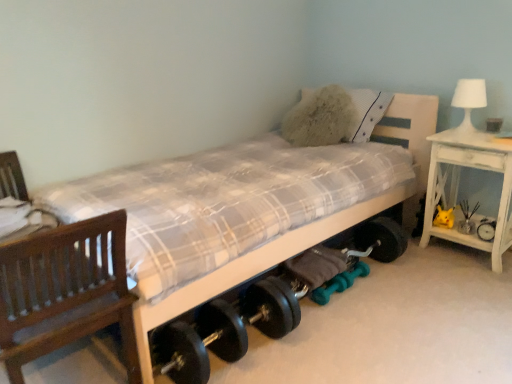
Where is `fuzzy white pillow at upper center`? The image size is (512, 384). fuzzy white pillow at upper center is located at coordinates (368, 111).

The height and width of the screenshot is (384, 512). What do you see at coordinates (332, 288) in the screenshot?
I see `teal rubber dumbbell at lower center, placed as the 2th dumbbell when sorted from right to left` at bounding box center [332, 288].

In order to click on white distressed wood nightstand at right in this screenshot , I will do `click(458, 186)`.

Where is `white wood bed at center`? white wood bed at center is located at coordinates (310, 224).

Is teal rubber dumbbell at lower center, placed as the 2th dumbbell when sorted from right to left, spatially inside white distressed wood nightstand at right, or outside of it?

The correct answer is: outside.

Is teal rubber dumbbell at lower center, marked as the first dumbbell in a left-to-right arrangement, smaller than white distressed wood nightstand at right?

Indeed, teal rubber dumbbell at lower center, marked as the first dumbbell in a left-to-right arrangement, has a smaller size compared to white distressed wood nightstand at right.

From a real-world perspective, is teal rubber dumbbell at lower center, placed as the 2th dumbbell when sorted from right to left, beneath white distressed wood nightstand at right?

Yes.

Does teal rubber dumbbell at lower center, marked as the first dumbbell in a left-to-right arrangement, have a lesser width compared to white distressed wood nightstand at right?

Indeed, teal rubber dumbbell at lower center, marked as the first dumbbell in a left-to-right arrangement, has a lesser width compared to white distressed wood nightstand at right.

Is teal rubber dumbbell at lower center, which appears as the 2th dumbbell when viewed from the left, wider than white distressed wood nightstand at right?

In fact, teal rubber dumbbell at lower center, which appears as the 2th dumbbell when viewed from the left, might be narrower than white distressed wood nightstand at right.

From the picture: Which is farther, (x=355, y=278) or (x=445, y=175)?

Point (x=445, y=175)

Are teal rubber dumbbell at lower center, which appears as the 2th dumbbell when viewed from the left, and white distressed wood nightstand at right making contact?

There is a gap between teal rubber dumbbell at lower center, which appears as the 2th dumbbell when viewed from the left, and white distressed wood nightstand at right.

Is point (344, 290) closer or farther from the camera than point (474, 227)?

Point (344, 290) appears to be closer to the viewer than point (474, 227).

Does teal rubber dumbbell at lower center, placed as the 2th dumbbell when sorted from right to left, have a lesser height compared to yellow plush toy at right?

Yes.

Locate an element on the screen. toy that is above the teal rubber dumbbell at lower center, marked as the first dumbbell in a left-to-right arrangement (from a real-world perspective) is located at coordinates (467, 218).

Which of these two, teal rubber dumbbell at lower center, placed as the 2th dumbbell when sorted from right to left, or yellow plush toy at right, is thinner?

teal rubber dumbbell at lower center, placed as the 2th dumbbell when sorted from right to left, is thinner.

Is white glossy table lamp at upper right located within white distressed wood nightstand at right?

No, white glossy table lamp at upper right is not a part of white distressed wood nightstand at right.

Based on the photo, between white distressed wood nightstand at right and white glossy table lamp at upper right, which one has smaller size?

white glossy table lamp at upper right is smaller.

Which is more distant, (460, 136) or (475, 99)?

Point (475, 99)

Between white distressed wood nightstand at right and white glossy table lamp at upper right, which one appears on the right side from the viewer's perspective?

From the viewer's perspective, white distressed wood nightstand at right appears more on the right side.

What's the angular difference between white distressed wood nightstand at right and yellow plush toy at right's facing directions?

There is a 2.75-degree angle between the facing directions of white distressed wood nightstand at right and yellow plush toy at right.

Is white distressed wood nightstand at right closer to camera compared to yellow plush toy at right?

That is True.

Can you confirm if white distressed wood nightstand at right is wider than yellow plush toy at right?

Yes.

Is teal rubber dumbbell at lower center, the first dumbbell from the right, positioned behind brown wooden chair at left?

That is True.

From a real-world perspective, is teal rubber dumbbell at lower center, which appears as the 2th dumbbell when viewed from the left, positioned over brown wooden chair at left based on gravity?

No.

Is teal rubber dumbbell at lower center, the first dumbbell from the right, far away from brown wooden chair at left?

Yes.

Considering the relative sizes of teal rubber dumbbell at lower center, which appears as the 2th dumbbell when viewed from the left, and brown wooden chair at left in the image provided, is teal rubber dumbbell at lower center, which appears as the 2th dumbbell when viewed from the left, bigger than brown wooden chair at left?

Incorrect, teal rubber dumbbell at lower center, which appears as the 2th dumbbell when viewed from the left, is not larger than brown wooden chair at left.

Find the location of a particular element. This screenshot has height=384, width=512. table lamp on the right of white wood bed at center is located at coordinates (469, 100).

From a real-world perspective, between white glossy table lamp at upper right and white wood bed at center, who is vertically higher?

white glossy table lamp at upper right, from a real-world perspective.

Who is shorter, white glossy table lamp at upper right or white wood bed at center?

white glossy table lamp at upper right is shorter.

Is white glossy table lamp at upper right next to white wood bed at center and touching it?

There is a gap between white glossy table lamp at upper right and white wood bed at center.

Identify the location of nightstand to the right of teal rubber dumbbell at lower center, marked as the first dumbbell in a left-to-right arrangement. This screenshot has width=512, height=384. (458, 186).

The image size is (512, 384). In order to click on nightstand lying above the teal rubber dumbbell at lower center, the first dumbbell from the right (from the image's perspective) in this screenshot , I will do tap(458, 186).

Considering their positions, is yellow plush toy at right positioned closer to white distressed wood nightstand at right than brown wooden chair at left?

Based on the image, yellow plush toy at right appears to be nearer to white distressed wood nightstand at right.

Looking at the image, which one is located further to white wood bed at center, teal rubber dumbbell at lower center, the first dumbbell from the right, or brown wooden chair at left?

Among the two, teal rubber dumbbell at lower center, the first dumbbell from the right, is located further to white wood bed at center.

Estimate the real-world distances between objects in this image. Which object is further from teal rubber dumbbell at lower center, placed as the 2th dumbbell when sorted from right to left, fuzzy white pillow at upper center or white wood bed at center?

Based on the image, fuzzy white pillow at upper center appears to be further to teal rubber dumbbell at lower center, placed as the 2th dumbbell when sorted from right to left.

From the image, which object appears to be nearer to teal rubber dumbbell at lower center, marked as the first dumbbell in a left-to-right arrangement, white distressed wood nightstand at right or brown wooden chair at left?

Among the two, white distressed wood nightstand at right is located nearer to teal rubber dumbbell at lower center, marked as the first dumbbell in a left-to-right arrangement.

From the image, which object appears to be farther from teal rubber dumbbell at lower center, marked as the first dumbbell in a left-to-right arrangement, teal rubber dumbbell at lower center, the first dumbbell from the right, or fuzzy white pillow at upper center?

fuzzy white pillow at upper center.

From the image, which object appears to be nearer to teal rubber dumbbell at lower center, which appears as the 2th dumbbell when viewed from the left, yellow plush toy at right or white wood bed at center?

The object closer to teal rubber dumbbell at lower center, which appears as the 2th dumbbell when viewed from the left, is white wood bed at center.

Consider the image. Based on their spatial positions, is brown wooden chair at left or teal rubber dumbbell at lower center, marked as the first dumbbell in a left-to-right arrangement, closer to white wood bed at center?

brown wooden chair at left is positioned closer to the anchor white wood bed at center.

Estimate the real-world distances between objects in this image. Which object is further from white glossy table lamp at upper right, teal rubber dumbbell at lower center, marked as the first dumbbell in a left-to-right arrangement, or white distressed wood nightstand at right?

teal rubber dumbbell at lower center, marked as the first dumbbell in a left-to-right arrangement, is further to white glossy table lamp at upper right.

You are a GUI agent. You are given a task and a screenshot of the screen. Output one action in this format:
    pyautogui.click(x=<x>, y=<y>)
    Task: Click on the toy between white wood bed at center and white distressed wood nightstand at right in the horizontal direction
    
    Given the screenshot: What is the action you would take?
    pyautogui.click(x=467, y=218)

You are a GUI agent. You are given a task and a screenshot of the screen. Output one action in this format:
    pyautogui.click(x=<x>, y=<y>)
    Task: Click on the nightstand between fuzzy white pillow at upper center and teal rubber dumbbell at lower center, placed as the 2th dumbbell when sorted from right to left, in the up-down direction
    The width and height of the screenshot is (512, 384).
    Given the screenshot: What is the action you would take?
    pyautogui.click(x=458, y=186)

Where is `dumbbell between fuzzy white pillow at upper center and teal rubber dumbbell at lower center, marked as the first dumbbell in a left-to-right arrangement, from top to bottom`? The width and height of the screenshot is (512, 384). dumbbell between fuzzy white pillow at upper center and teal rubber dumbbell at lower center, marked as the first dumbbell in a left-to-right arrangement, from top to bottom is located at coordinates (352, 275).

Where is `bed situated between brown wooden chair at left and yellow plush toy at right from left to right`? Image resolution: width=512 pixels, height=384 pixels. bed situated between brown wooden chair at left and yellow plush toy at right from left to right is located at coordinates (310, 224).